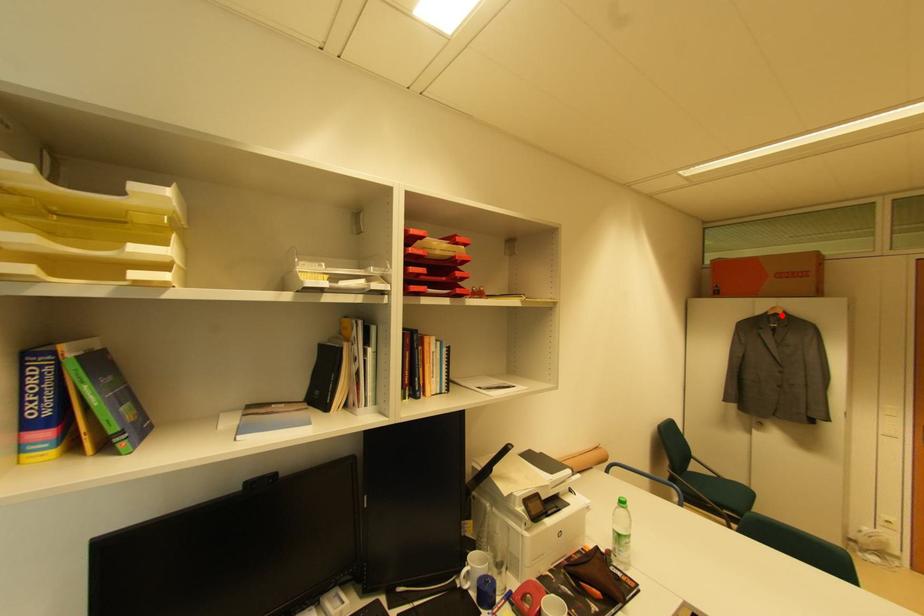
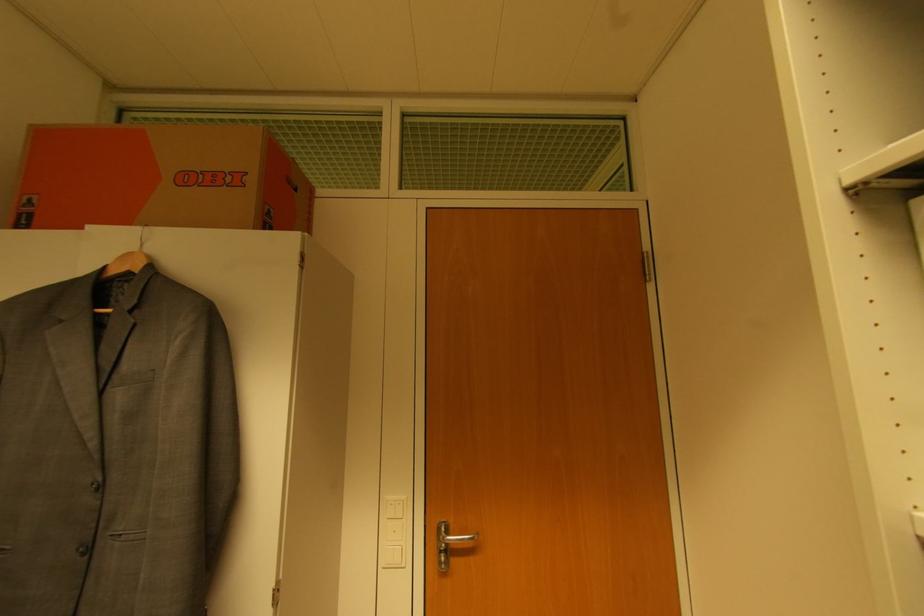
The point at the highlighted location is marked in the first image. Where is the corresponding point in the second image?

(137, 270)